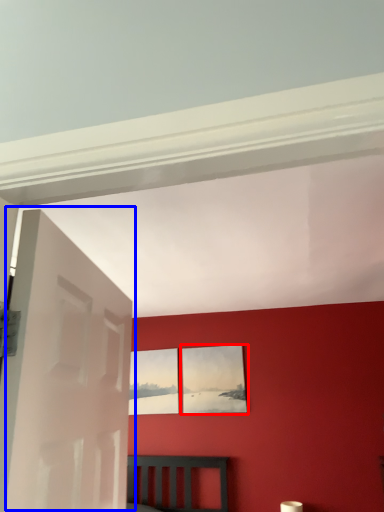
Question: Among these objects, which one is farthest to the camera, picture frame (highlighted by a red box) or door (highlighted by a blue box)?

Choices:
 (A) picture frame
 (B) door

Answer: (A)